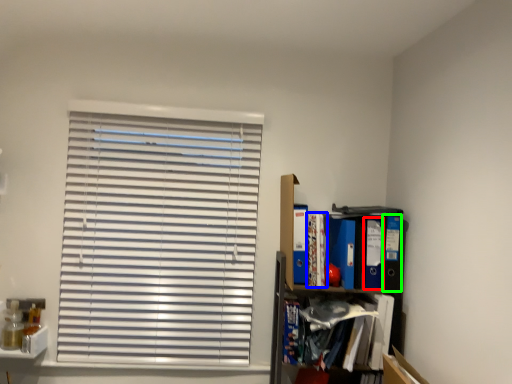
Question: Which is nearer to the paperback book (highlighted by a red box)? book (highlighted by a blue box) or paperback book (highlighted by a green box).

Choices:
 (A) book
 (B) paperback book

Answer: (B)